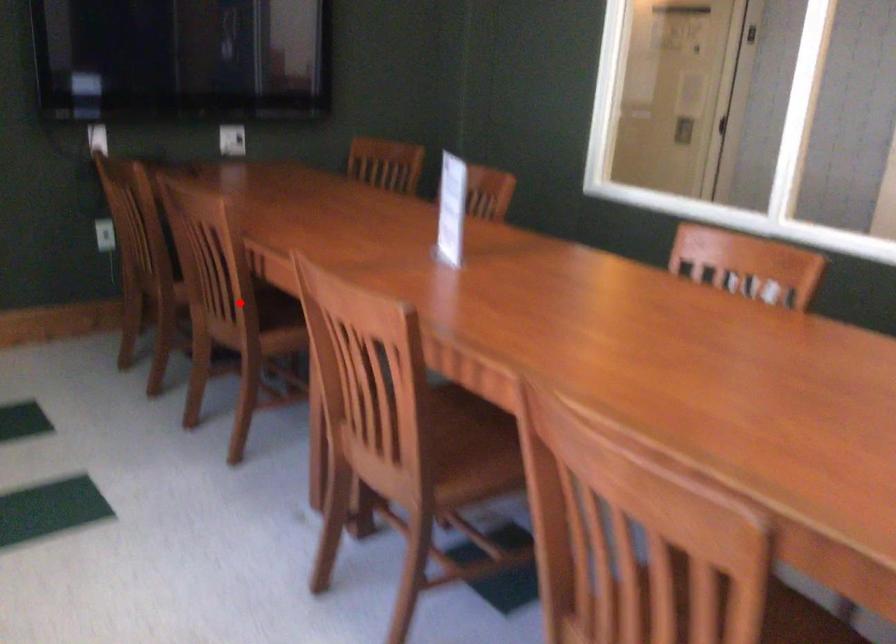
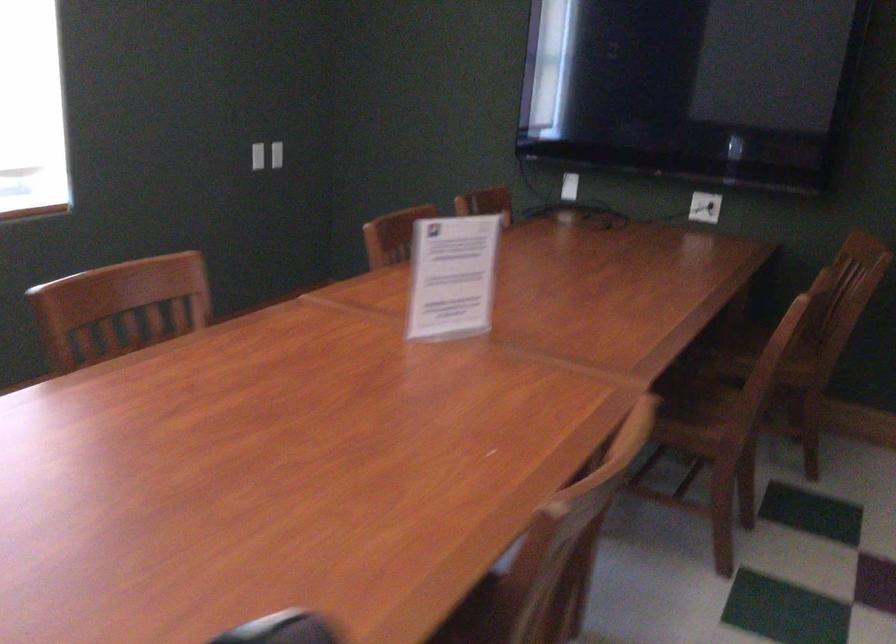
Question: I am providing you with two images of the same scene from different viewpoints. A red point is marked on the first image. Is the red point's position out of view in image 2?

Choices:
 (A) Yes
 (B) No

Answer: (A)